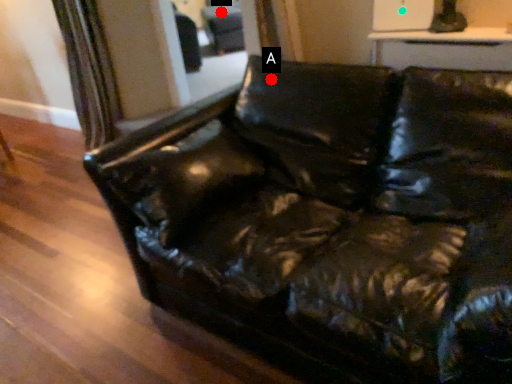
Question: Two points are circled on the image, labeled by A and B beside each circle. Which of the following is the closest to the observer?

Choices:
 (A) A is closer
 (B) B is closer

Answer: (A)